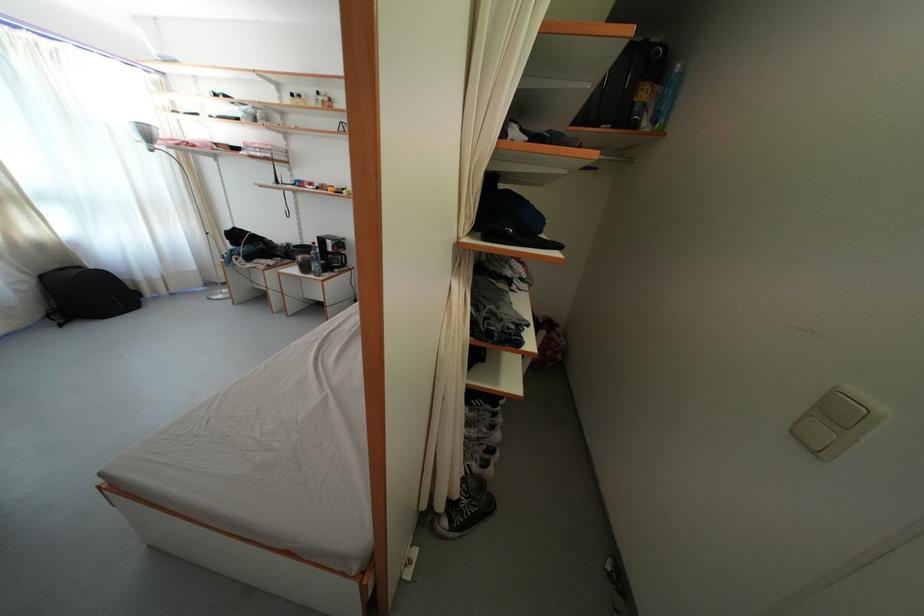
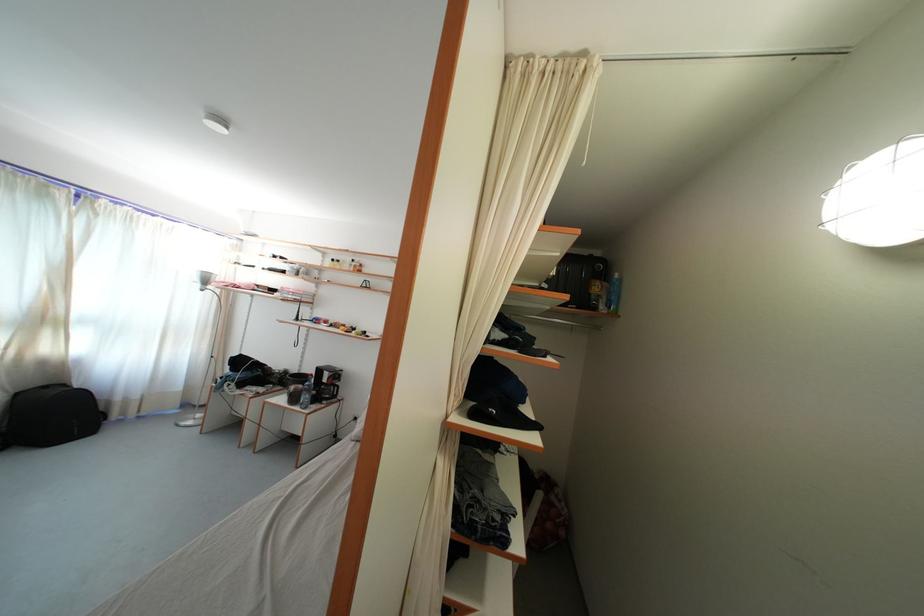
In the second image, find the point that corresponds to (311,274) in the first image.

(300, 405)